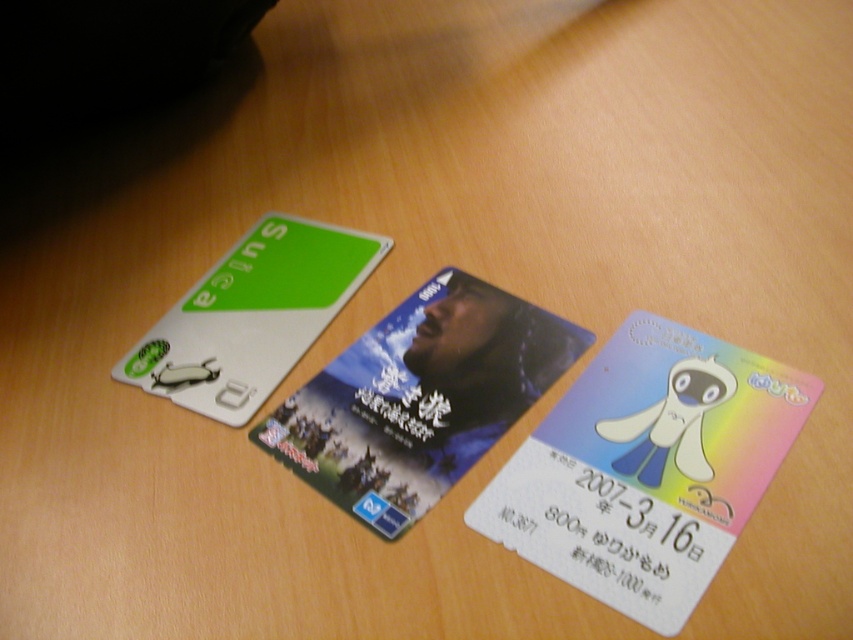
Can you confirm if matte plastic card at center is positioned below green matte suica card at upper left?

Indeed, matte plastic card at center is positioned under green matte suica card at upper left.

Identify the location of matte plastic card at center. (419, 397).

Is point (402, 529) closer to camera compared to point (200, 358)?

Yes, it is in front of point (200, 358).

Identify the location of matte plastic card at center. (419, 397).

Looking at this image, can you confirm if pastel rainbow card at center is positioned to the left of green matte suica card at upper left?

No, pastel rainbow card at center is not to the left of green matte suica card at upper left.

Who is positioned more to the right, pastel rainbow card at center or green matte suica card at upper left?

pastel rainbow card at center is more to the right.

Image resolution: width=853 pixels, height=640 pixels. What do you see at coordinates (647, 467) in the screenshot? I see `pastel rainbow card at center` at bounding box center [647, 467].

This screenshot has width=853, height=640. I want to click on pastel rainbow card at center, so click(x=647, y=467).

Can you confirm if pastel rainbow card at center is positioned above matte plastic card at center?

Incorrect, pastel rainbow card at center is not positioned above matte plastic card at center.

Does point (679, 512) come in front of point (323, 433)?

That is True.

The height and width of the screenshot is (640, 853). What do you see at coordinates (647, 467) in the screenshot? I see `pastel rainbow card at center` at bounding box center [647, 467].

Find the location of a particular element. pastel rainbow card at center is located at coordinates (647, 467).